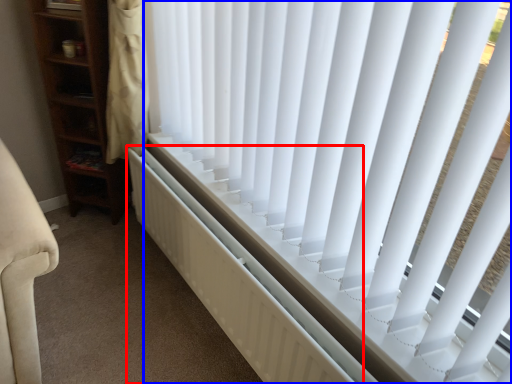
Question: Which object appears farthest to the camera in this image, radiator (highlighted by a red box) or window blind (highlighted by a blue box)?

Choices:
 (A) radiator
 (B) window blind

Answer: (A)